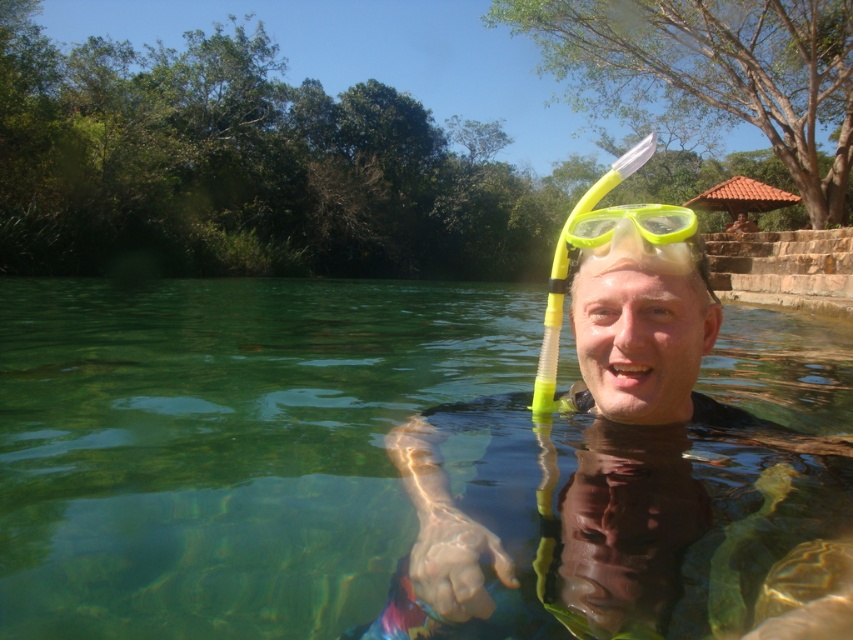
Question: Which point is farther to the camera?

Choices:
 (A) (421, 352)
 (B) (677, 221)

Answer: (A)

Question: Estimate the real-world distances between objects in this image. Which object is closer to the clear water at center?

Choices:
 (A) yellow rubber goggles at center
 (B) yellow matte snorkel at center

Answer: (B)

Question: Does yellow matte snorkel at center lie behind yellow rubber goggles at center?

Choices:
 (A) yes
 (B) no

Answer: (A)

Question: Where is clear water at center located in relation to yellow rubber goggles at center in the image?

Choices:
 (A) left
 (B) right

Answer: (A)

Question: Is yellow matte snorkel at center positioned in front of yellow rubber goggles at center?

Choices:
 (A) yes
 (B) no

Answer: (B)

Question: Which object is positioned closest to the clear water at center?

Choices:
 (A) yellow rubber goggles at center
 (B) yellow matte snorkel at center

Answer: (B)